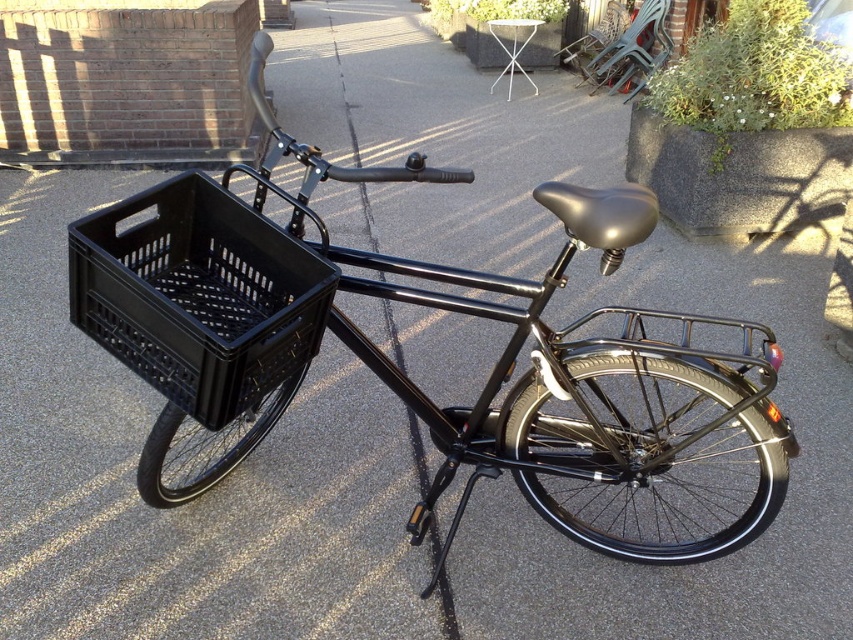
Question: Observing the image, what is the correct spatial positioning of black matte bicycle at center in reference to black plastic basket at left?

Choices:
 (A) below
 (B) above

Answer: (A)

Question: Can you confirm if black matte bicycle at center is smaller than black plastic basket at left?

Choices:
 (A) yes
 (B) no

Answer: (B)

Question: Which object is closer to the camera taking this photo?

Choices:
 (A) black matte bicycle at center
 (B) black plastic basket at left

Answer: (B)

Question: Does black matte bicycle at center appear under black plastic basket at left?

Choices:
 (A) no
 (B) yes

Answer: (B)